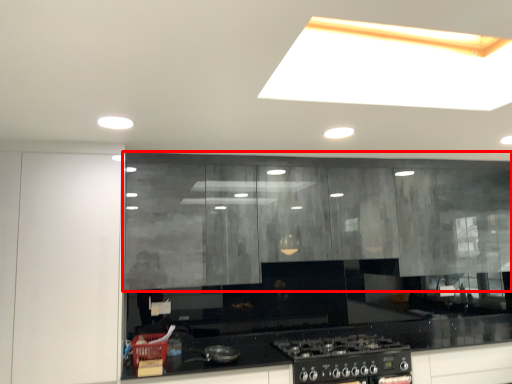
Question: Observing the image, what is the correct spatial positioning of cabinetry (annotated by the red box) in reference to glass door?

Choices:
 (A) right
 (B) left

Answer: (A)